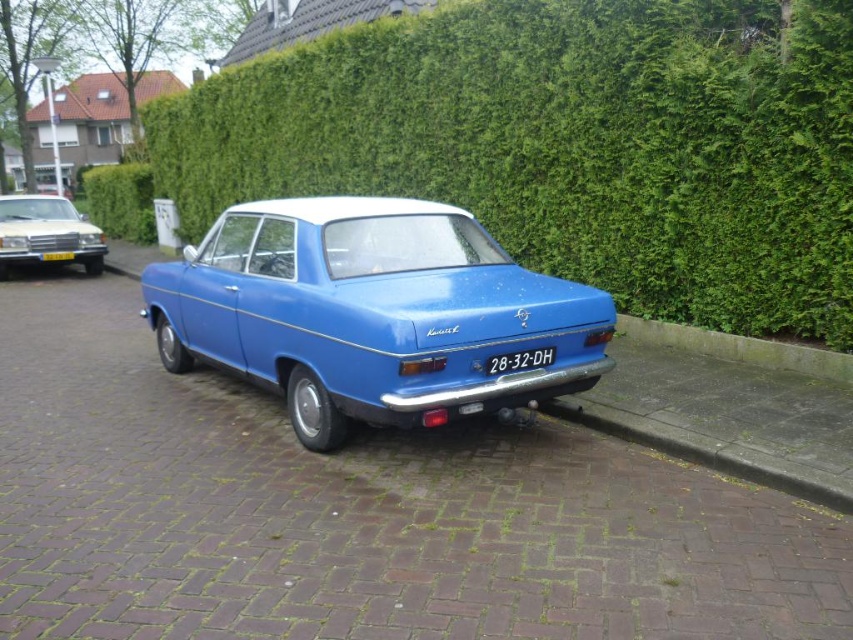
You are standing in front of the car and want to walk to the hedge. Which direction should you move to get closer to the green leafy hedge at upper center without passing the matte silver car at left?

Since the green leafy hedge at upper center is closer to the viewer than the matte silver car at left, you should move forward towards the hedge without needing to go around the car.

You are standing in front of the vintage car and want to take a photo of the matte silver car at left and the yellow plastic license plate at center. Which object is positioned closer to you?

The matte silver car at left is closer to the viewer than the yellow plastic license plate at center.

You are a photographer trying to capture the blue glossy sedan at center and the yellow plastic license plate at center in a single shot. Given that your camera can only focus on objects within a 1.5 meter width, will both objects fit in the frame?

The blue glossy sedan at center is wider than the yellow plastic license plate at center. Since the camera can only focus on objects within a 1.5 meter width, if the sedan is wider than 1.5 meters, it might not fit entirely. However, the license plate is smaller, so it should fit. But since the question is about both fitting in the frame, the sedan might exceed the width limit, making it impossible to capture both fully.